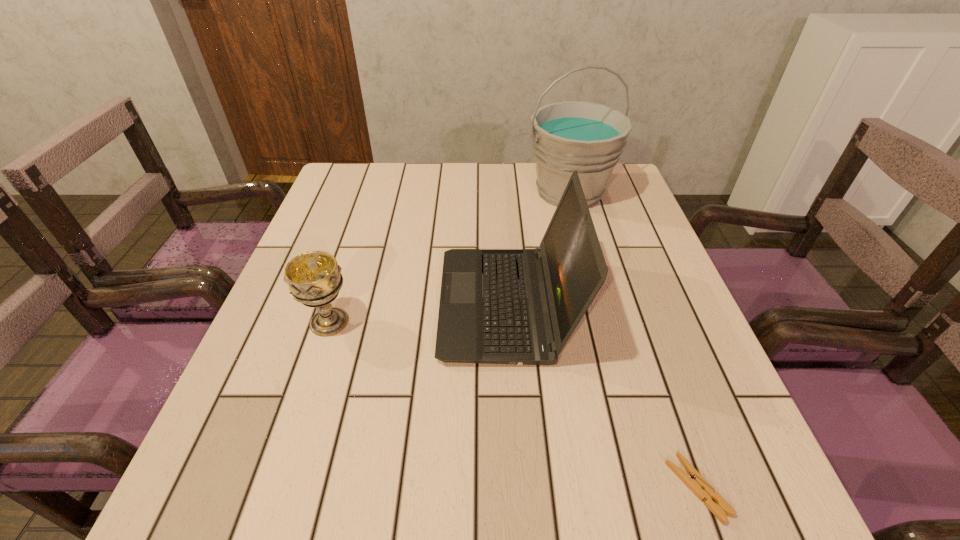
This screenshot has height=540, width=960. Identify the location of bucket. (588, 137).

Find the location of a particular element. This screenshot has width=960, height=540. the tallest object is located at coordinates (588, 137).

Locate an element on the screen. The width and height of the screenshot is (960, 540). laptop_computer is located at coordinates 497,306.

Where is `the third tallest object`? Image resolution: width=960 pixels, height=540 pixels. the third tallest object is located at coordinates (314, 278).

At what (x,y) coordinates should I click in order to perform the action: click on chalice. Please return your answer as a coordinate pair (x, y). The image size is (960, 540). Looking at the image, I should click on (314, 278).

This screenshot has height=540, width=960. In order to click on the nearest object in this screenshot , I will do `click(694, 481)`.

At what (x,y) coordinates should I click in order to perform the action: click on the shortest object. Please return your answer as a coordinate pair (x, y). Looking at the image, I should click on (694, 481).

This screenshot has height=540, width=960. In order to click on free space located on the left of the farthest object in this screenshot , I will do `click(483, 192)`.

Locate an element on the screen. The image size is (960, 540). free spot located 0.220m on the screen of the second tallest object is located at coordinates (336, 305).

The image size is (960, 540). I want to click on free location located 0.080m on the screen of the second tallest object, so click(x=402, y=305).